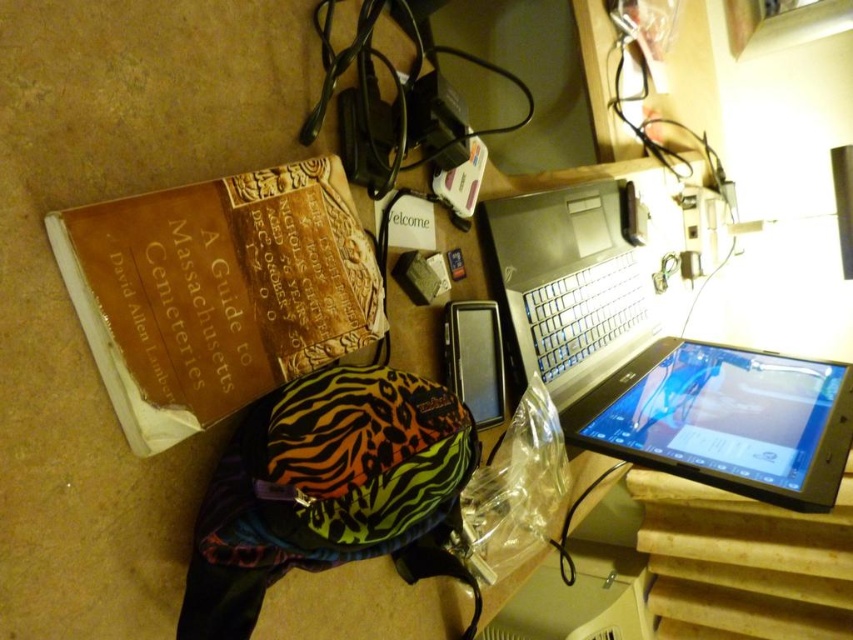
Question: Estimate the real-world distances between objects in this image. Which object is closer to the matte black tablet at lower right?

Choices:
 (A) sleek black laptop at center
 (B) black plastic keyboard at center-right
 (C) zebra-patterned fabric at center
 (D) brown paper book at upper left

Answer: (B)

Question: Does black plastic keyboard at center-right have a smaller size compared to black matte tablet at center?

Choices:
 (A) no
 (B) yes

Answer: (A)

Question: Does matte black tablet at lower right lie in front of black matte tablet at center?

Choices:
 (A) yes
 (B) no

Answer: (A)

Question: From the image, what is the correct spatial relationship of zebra-patterned fabric at center in relation to black matte tablet at center?

Choices:
 (A) right
 (B) left

Answer: (B)

Question: Which of these objects is positioned farthest from the sleek black laptop at center?

Choices:
 (A) brown paper book at upper left
 (B) black plastic keyboard at center-right

Answer: (A)

Question: Which of these objects is positioned closest to the sleek black laptop at center?

Choices:
 (A) brown paper book at upper left
 (B) black matte tablet at center

Answer: (B)